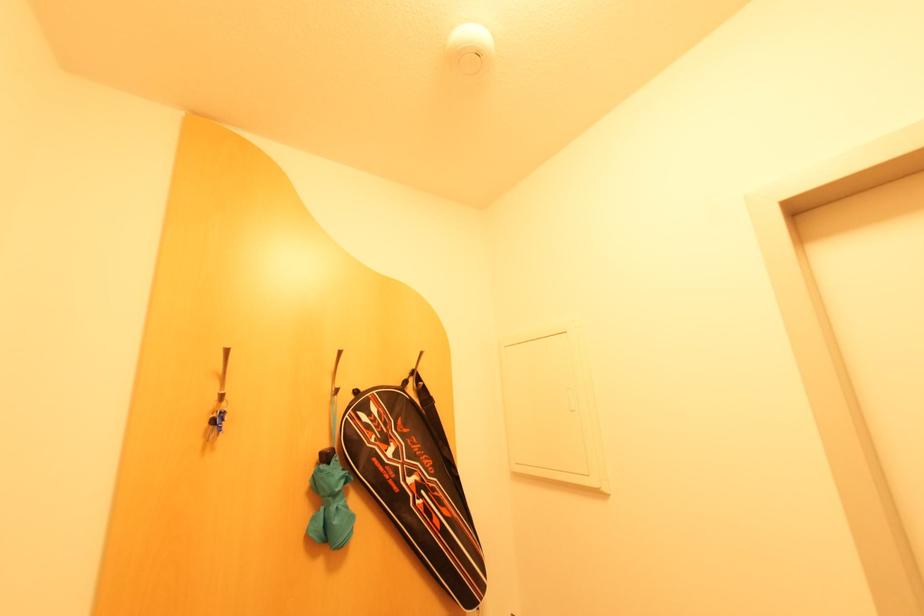
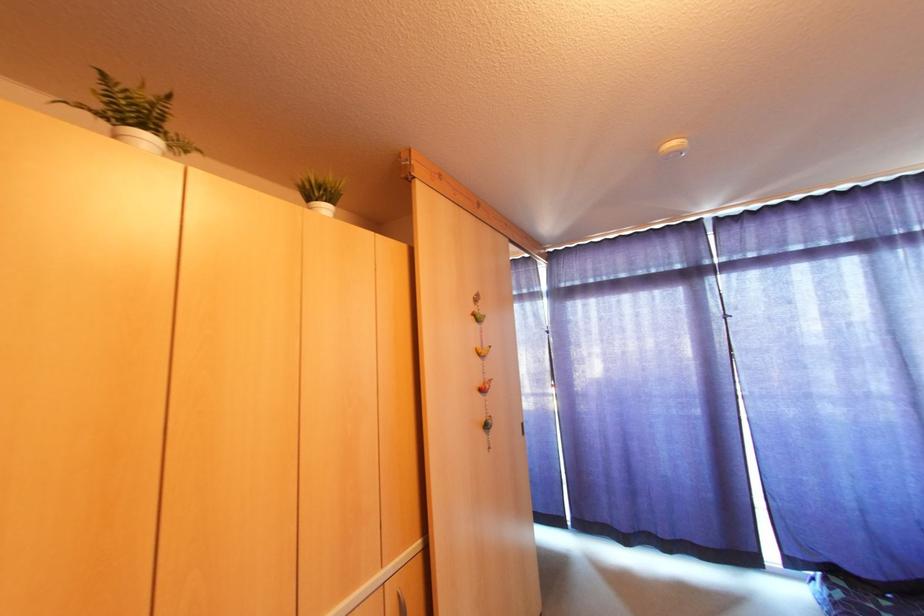
Question: What movement of the cameraman would produce the second image?

Choices:
 (A) Left
 (B) Right
 (C) Forward
 (D) Backward

Answer: (B)